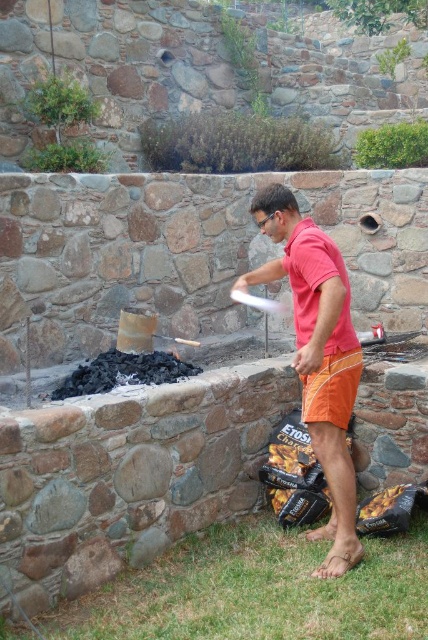
What do you see at coordinates (122, 372) in the screenshot? I see `black charcoal at lower left` at bounding box center [122, 372].

Identify the location of black charcoal at lower left. (122, 372).

At what (x,y) coordinates should I click in order to perform the action: click on black charcoal at lower left. Please return your answer as a coordinate pair (x, y). The image size is (428, 640). Looking at the image, I should click on (122, 372).

Which is more to the left, matte red shirt at center or black charcoal at lower left?

black charcoal at lower left is more to the left.

Is point (278, 268) more distant than point (187, 372)?

No, it is not.

The image size is (428, 640). I want to click on matte red shirt at center, so click(x=318, y=355).

Which is behind, point (333, 509) or point (345, 410)?

Positioned behind is point (333, 509).

Does matte red shirt at center lie behind orange fabric shorts at center?

No, it is not.

Where is `matte red shirt at center`? The width and height of the screenshot is (428, 640). matte red shirt at center is located at coordinates coord(318,355).